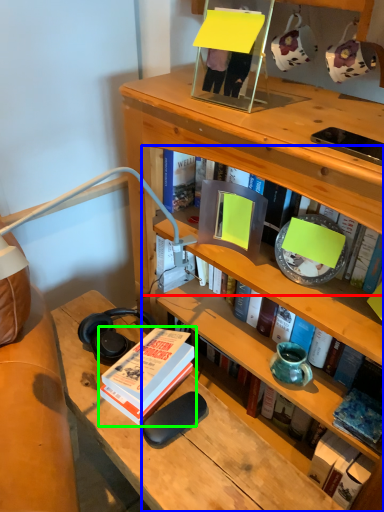
Question: Which object is the farthest from book (highlighted by a red box)? Choose among these: book (highlighted by a blue box) or book (highlighted by a green box).

Choices:
 (A) book
 (B) book

Answer: (B)